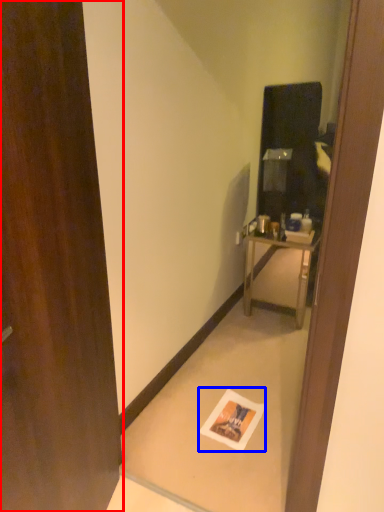
Question: Which object appears farthest to the camera in this image, door (highlighted by a red box) or postcard (highlighted by a blue box)?

Choices:
 (A) door
 (B) postcard

Answer: (B)